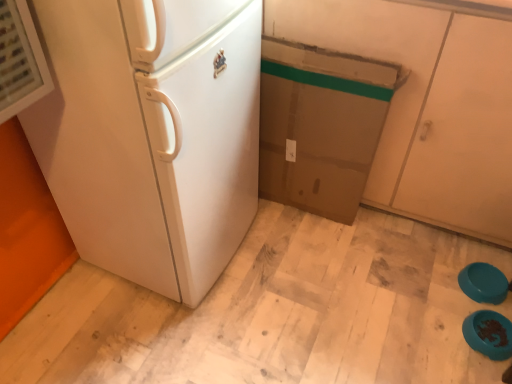
Image resolution: width=512 pixels, height=384 pixels. Describe the element at coordinates (483, 283) in the screenshot. I see `teal plastic bowls at lower right, the 2th appliance viewed from the front` at that location.

Where is `white matte refrigerator at left`? white matte refrigerator at left is located at coordinates (151, 134).

Locate an element on the screen. This screenshot has width=512, height=384. teal plastic bowls at lower right, the 2th appliance viewed from the front is located at coordinates (483, 283).

Is teal plastic bowls at lower right, the 2th appliance viewed from the front, located within matte brown cabinet at center?

That's incorrect, teal plastic bowls at lower right, the 2th appliance viewed from the front, is not inside matte brown cabinet at center.

Is matte brown cabinet at center to the right of teal plastic bowls at lower right, the 2th appliance viewed from the front, from the viewer's perspective?

No.

Between matte brown cabinet at center and teal plastic bowls at lower right, which appears as the 1th appliance when viewed from the back, which one has smaller width?

With smaller width is teal plastic bowls at lower right, which appears as the 1th appliance when viewed from the back.

From their relative heights in the image, would you say matte brown cabinet at center is taller or shorter than teal plastic bowls at lower right, which appears as the 1th appliance when viewed from the back?

Considering their sizes, matte brown cabinet at center has more height than teal plastic bowls at lower right, which appears as the 1th appliance when viewed from the back.

At what (x,y) coordinates should I click in order to perform the action: click on cabinetry below the white matte refrigerator at left (from a real-world perspective). Please return your answer as a coordinate pair (x, y). Looking at the image, I should click on (426, 106).

Between white matte refrigerator at left and matte brown cabinet at center, which one is positioned in front?

Positioned in front is white matte refrigerator at left.

Looking at this image, which of these two, teal glossy bowls at lower right, the 2th appliance in the back-to-front sequence, or teal plastic bowls at lower right, which appears as the 1th appliance when viewed from the back, is thinner?

teal plastic bowls at lower right, which appears as the 1th appliance when viewed from the back, is thinner.

Considering the sizes of teal glossy bowls at lower right, the 2th appliance in the back-to-front sequence, and teal plastic bowls at lower right, the 2th appliance viewed from the front, in the image, is teal glossy bowls at lower right, the 2th appliance in the back-to-front sequence, taller or shorter than teal plastic bowls at lower right, the 2th appliance viewed from the front,?

teal glossy bowls at lower right, the 2th appliance in the back-to-front sequence, is taller than teal plastic bowls at lower right, the 2th appliance viewed from the front.

Who is bigger, teal glossy bowls at lower right, the 2th appliance in the back-to-front sequence, or teal plastic bowls at lower right, which appears as the 1th appliance when viewed from the back?

With larger size is teal glossy bowls at lower right, the 2th appliance in the back-to-front sequence.

Does teal plastic bowls at lower right, the 2th appliance viewed from the front, have a greater height compared to matte brown cabinet at center?

No.

Is teal plastic bowls at lower right, the 2th appliance viewed from the front, wider or thinner than matte brown cabinet at center?

teal plastic bowls at lower right, the 2th appliance viewed from the front, is thinner than matte brown cabinet at center.

Is teal plastic bowls at lower right, which appears as the 1th appliance when viewed from the back, at the right side of matte brown cabinet at center?

Indeed, teal plastic bowls at lower right, which appears as the 1th appliance when viewed from the back, is positioned on the right side of matte brown cabinet at center.

Can matte brown cabinet at center be found inside teal plastic bowls at lower right, the 2th appliance viewed from the front?

No, matte brown cabinet at center is located outside of teal plastic bowls at lower right, the 2th appliance viewed from the front.

From the image's perspective, which one is positioned lower, teal glossy bowls at lower right, marked as the 1th appliance in a front-to-back arrangement, or matte brown cabinet at center?

teal glossy bowls at lower right, marked as the 1th appliance in a front-to-back arrangement, is shown below in the image.

Could you measure the distance between teal glossy bowls at lower right, marked as the 1th appliance in a front-to-back arrangement, and matte brown cabinet at center?

teal glossy bowls at lower right, marked as the 1th appliance in a front-to-back arrangement, is 69.86 centimeters from matte brown cabinet at center.

Considering the relative sizes of teal glossy bowls at lower right, the 2th appliance in the back-to-front sequence, and matte brown cabinet at center in the image provided, is teal glossy bowls at lower right, the 2th appliance in the back-to-front sequence, wider than matte brown cabinet at center?

In fact, teal glossy bowls at lower right, the 2th appliance in the back-to-front sequence, might be narrower than matte brown cabinet at center.

Which is in front, teal plastic bowls at lower right, which appears as the 1th appliance when viewed from the back, or white matte refrigerator at left?

white matte refrigerator at left is closer to the camera.

Is teal plastic bowls at lower right, the 2th appliance viewed from the front, to the left or to the right of white matte refrigerator at left in the image?

teal plastic bowls at lower right, the 2th appliance viewed from the front, is positioned on white matte refrigerator at left's right side.

Considering the positions of point (498, 302) and point (140, 9), is point (498, 302) closer or farther from the camera than point (140, 9)?

Point (498, 302).

Can you confirm if teal plastic bowls at lower right, the 2th appliance viewed from the front, is thinner than white matte refrigerator at left?

Yes.

Considering the sizes of objects matte brown cabinet at center and white matte refrigerator at left in the image provided, who is smaller, matte brown cabinet at center or white matte refrigerator at left?

Smaller between the two is white matte refrigerator at left.

Which is behind, point (432, 89) or point (103, 235)?

Point (103, 235)

Considering the sizes of objects matte brown cabinet at center and white matte refrigerator at left in the image provided, who is taller, matte brown cabinet at center or white matte refrigerator at left?

white matte refrigerator at left.

Which is in front, matte brown cabinet at center or white matte refrigerator at left?

white matte refrigerator at left is in front.

This screenshot has width=512, height=384. I want to click on appliance that is the 2nd one when counting backward from the matte brown cabinet at center, so click(483, 283).

Identify the location of refrigerator that appears on the left of matte brown cabinet at center. (151, 134).

Estimate the real-world distances between objects in this image. Which object is closer to teal plastic bowls at lower right, which appears as the 1th appliance when viewed from the back, white matte refrigerator at left or matte brown cabinet at center?

The object closer to teal plastic bowls at lower right, which appears as the 1th appliance when viewed from the back, is matte brown cabinet at center.

Based on their spatial positions, is white matte refrigerator at left or teal glossy bowls at lower right, marked as the 1th appliance in a front-to-back arrangement, closer to teal plastic bowls at lower right, which appears as the 1th appliance when viewed from the back?

teal glossy bowls at lower right, marked as the 1th appliance in a front-to-back arrangement.

Looking at this image, considering their positions, is matte brown cabinet at center positioned further to white matte refrigerator at left than teal glossy bowls at lower right, the 2th appliance in the back-to-front sequence?

Based on the image, teal glossy bowls at lower right, the 2th appliance in the back-to-front sequence, appears to be further to white matte refrigerator at left.

When comparing their distances from matte brown cabinet at center, does teal plastic bowls at lower right, the 2th appliance viewed from the front, or teal glossy bowls at lower right, marked as the 1th appliance in a front-to-back arrangement, seem closer?

Among the two, teal plastic bowls at lower right, the 2th appliance viewed from the front, is located nearer to matte brown cabinet at center.

When comparing their distances from teal plastic bowls at lower right, the 2th appliance viewed from the front, does matte brown cabinet at center or white matte refrigerator at left seem closer?

matte brown cabinet at center is positioned closer to the anchor teal plastic bowls at lower right, the 2th appliance viewed from the front.

Based on their spatial positions, is teal glossy bowls at lower right, the 2th appliance in the back-to-front sequence, or teal plastic bowls at lower right, which appears as the 1th appliance when viewed from the back, closer to white matte refrigerator at left?

teal glossy bowls at lower right, the 2th appliance in the back-to-front sequence, is closer to white matte refrigerator at left.

When comparing their distances from teal glossy bowls at lower right, marked as the 1th appliance in a front-to-back arrangement, does white matte refrigerator at left or teal plastic bowls at lower right, the 2th appliance viewed from the front, seem further?

Based on the image, white matte refrigerator at left appears to be further to teal glossy bowls at lower right, marked as the 1th appliance in a front-to-back arrangement.

From the image, which object appears to be farther from matte brown cabinet at center, teal glossy bowls at lower right, marked as the 1th appliance in a front-to-back arrangement, or white matte refrigerator at left?

Based on the image, white matte refrigerator at left appears to be further to matte brown cabinet at center.

Image resolution: width=512 pixels, height=384 pixels. In order to click on appliance between matte brown cabinet at center and teal glossy bowls at lower right, the 2th appliance in the back-to-front sequence, vertically in this screenshot , I will do `click(483, 283)`.

Locate an element on the screen. This screenshot has width=512, height=384. appliance between white matte refrigerator at left and teal plastic bowls at lower right, which appears as the 1th appliance when viewed from the back is located at coordinates (489, 334).

The width and height of the screenshot is (512, 384). I want to click on cabinetry between white matte refrigerator at left and teal glossy bowls at lower right, marked as the 1th appliance in a front-to-back arrangement, from left to right, so click(x=426, y=106).

At what (x,y) coordinates should I click in order to perform the action: click on cabinetry between white matte refrigerator at left and teal plastic bowls at lower right, which appears as the 1th appliance when viewed from the back, in the horizontal direction. Please return your answer as a coordinate pair (x, y). The width and height of the screenshot is (512, 384). Looking at the image, I should click on (426, 106).